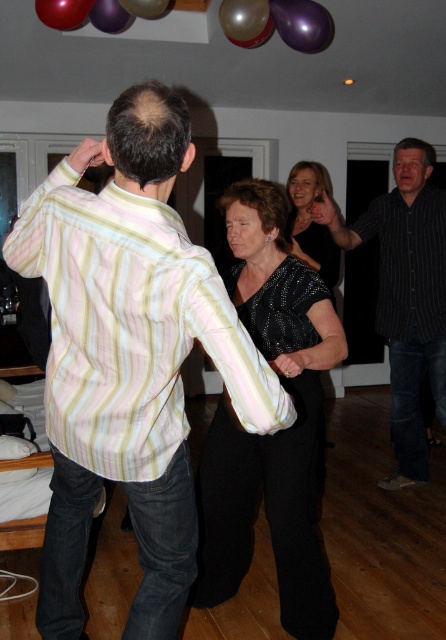
You are at a party and want to take a photo of the sparkly black dress at center and the metallic purple balloon at upper center. Which object should you focus on first if you want to capture both in the same frame without moving the camera?

The sparkly black dress at center is much taller than the metallic purple balloon at upper center, so you should focus on the sparkly black dress at center first to ensure it fits in the frame.

You are at a party and want to take a photo of the sparkly black dress at center and the metallic purple balloon at upper center. Which object will appear larger in the photo?

The sparkly black dress at center will appear larger in the photo because it is closer to the viewer than the metallic purple balloon at upper center.